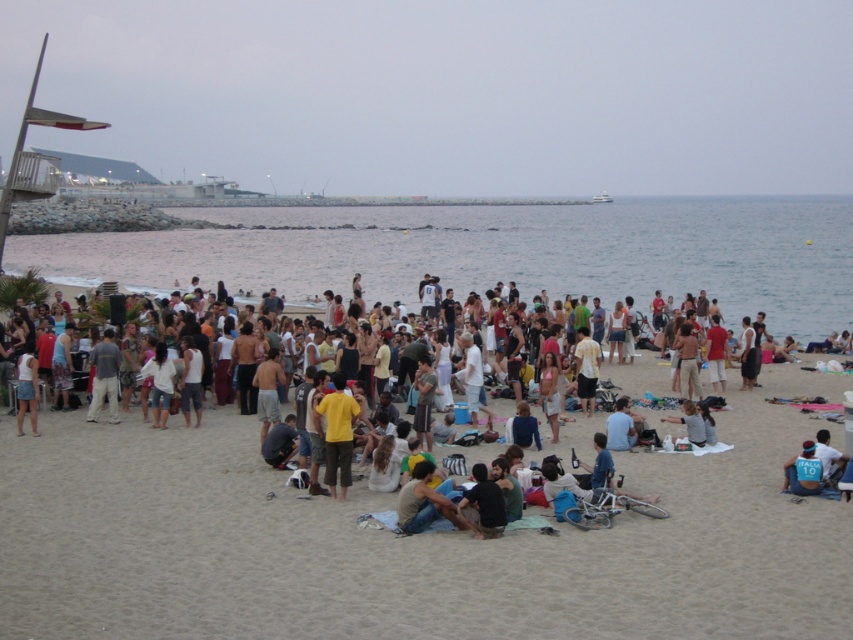
You are a lifeguard on duty at the beach. You notice a swimmer in the clear blue water at center who is struggling. The blue jersey at lower right is a rescue buoy. Can you reach the rescue buoy in time to help the swimmer?

The distance between the clear blue water at center and the blue jersey at lower right is 91.48 meters. Since the rescue buoy is over 90 meters away, it may be difficult to reach it quickly enough to assist the struggling swimmer.

You are standing at the beach and see two points marked in the image. The first point is at coordinates point (149, 266) and the second point is at point (788, 470). Which point is closer to you?

Point (788, 470) is closer to you because point (149, 266) is behind it.